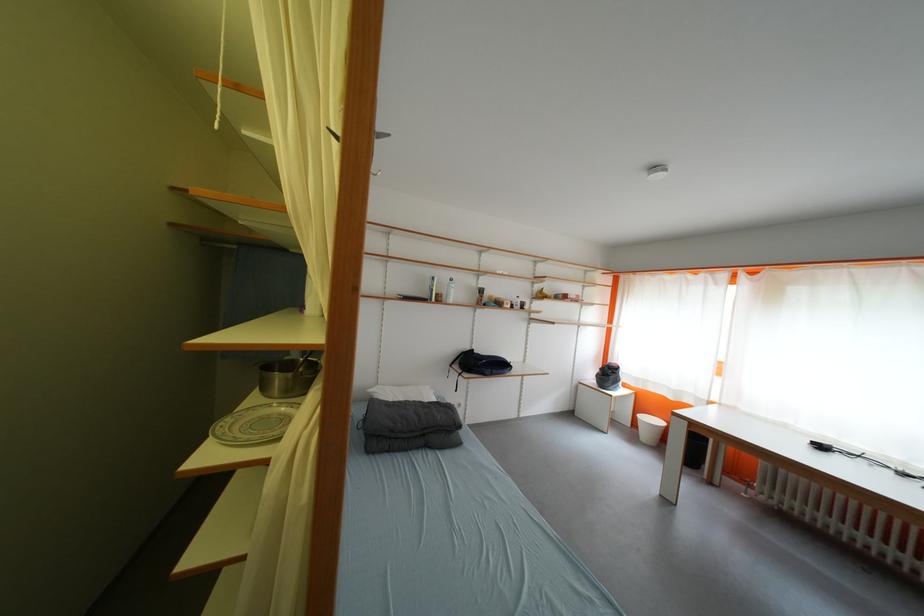
What do you see at coordinates (411, 297) in the screenshot?
I see `the blue book` at bounding box center [411, 297].